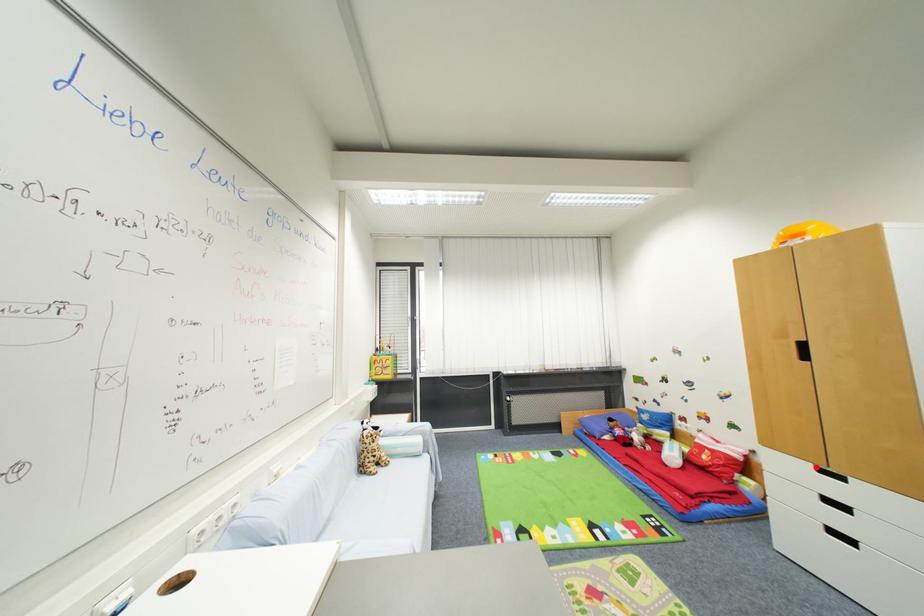
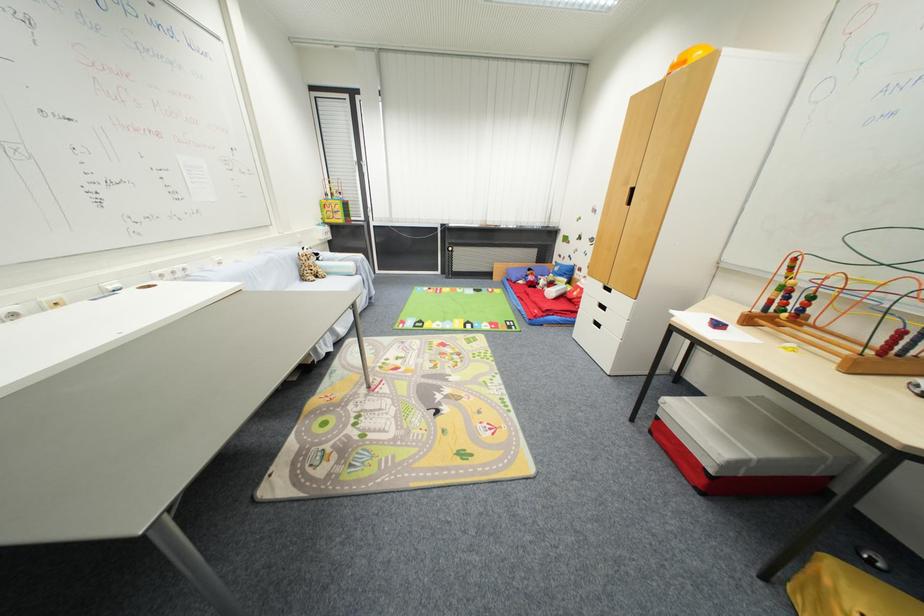
Question: I am providing you with two images of the same scene from different viewpoints. In image1, a red point is highlighted. Considering the same 3D point in image2, which of the following is correct?

Choices:
 (A) It is closer
 (B) It is farther

Answer: (A)